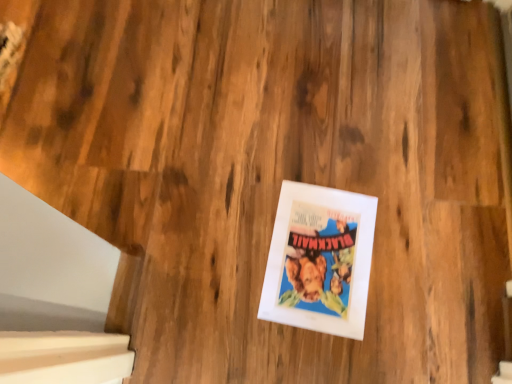
This screenshot has height=384, width=512. I want to click on blank space situated above white matte picture frame at center (from a real-world perspective), so click(x=315, y=252).